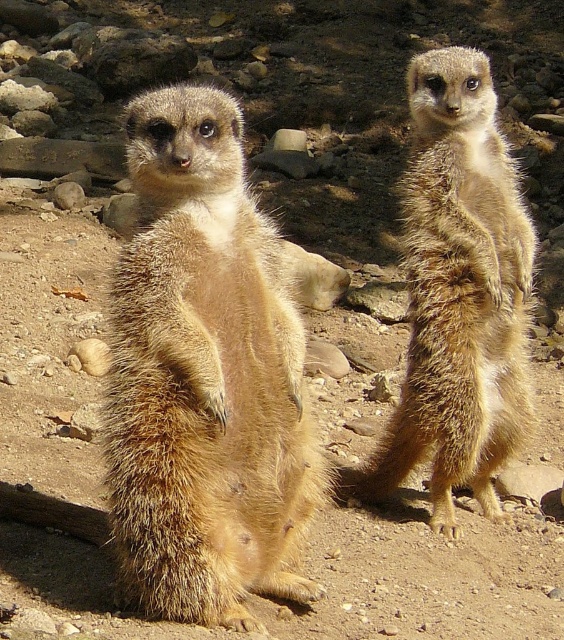
Question: In this image, where is fuzzy golden meerkat at center located relative to golden fur meerkat at upper right?

Choices:
 (A) above
 (B) below

Answer: (B)

Question: Does fuzzy golden meerkat at center lie behind golden fur meerkat at upper right?

Choices:
 (A) no
 (B) yes

Answer: (A)

Question: Which point is closer to the camera?

Choices:
 (A) golden fur meerkat at upper right
 (B) fuzzy golden meerkat at center

Answer: (B)

Question: Does fuzzy golden meerkat at center have a larger size compared to golden fur meerkat at upper right?

Choices:
 (A) yes
 (B) no

Answer: (B)